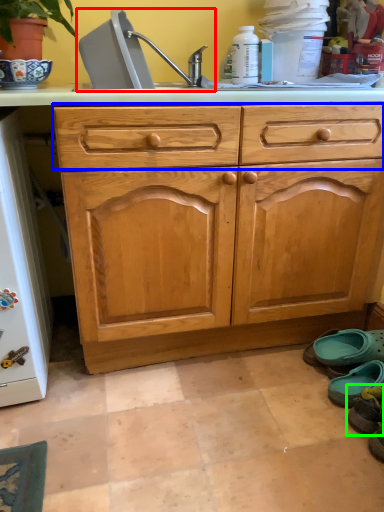
Question: Which is nearer to the sink (highlighted by a red box)? drawer (highlighted by a blue box) or footwear (highlighted by a green box).

Choices:
 (A) drawer
 (B) footwear

Answer: (A)